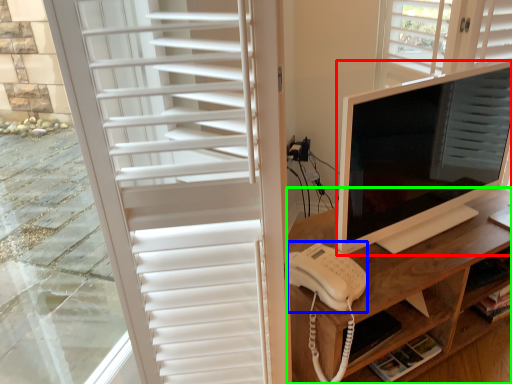
Question: Which object is positioned farthest from computer monitor (highlighted by a red box)? Select from open (highlighted by a blue box) and desk (highlighted by a green box).

Choices:
 (A) open
 (B) desk

Answer: (A)